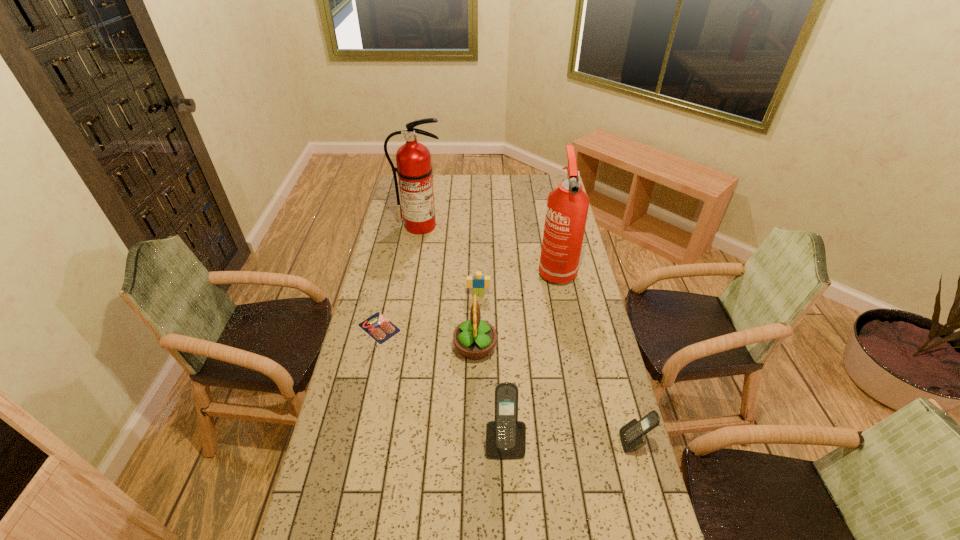
With all cellular telephones evenly spaced, where should an extra cellular telephone be placed on the left to continue the pattern? Please point out a vacant space. Please provide its 2D coordinates. Your answer should be formatted as a tuple, i.e. [(x, y)], where the tuple contains the x and y coordinates of a point satisfying the conditions above.

[(376, 440)]